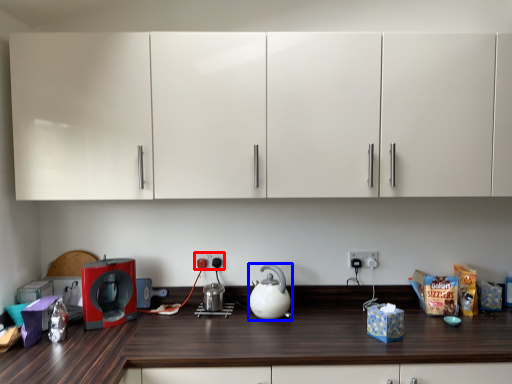
Question: Which of the following is the closest to the observer, electric outlet (highlighted by a red box) or kitchen appliance (highlighted by a blue box)?

Choices:
 (A) electric outlet
 (B) kitchen appliance

Answer: (B)